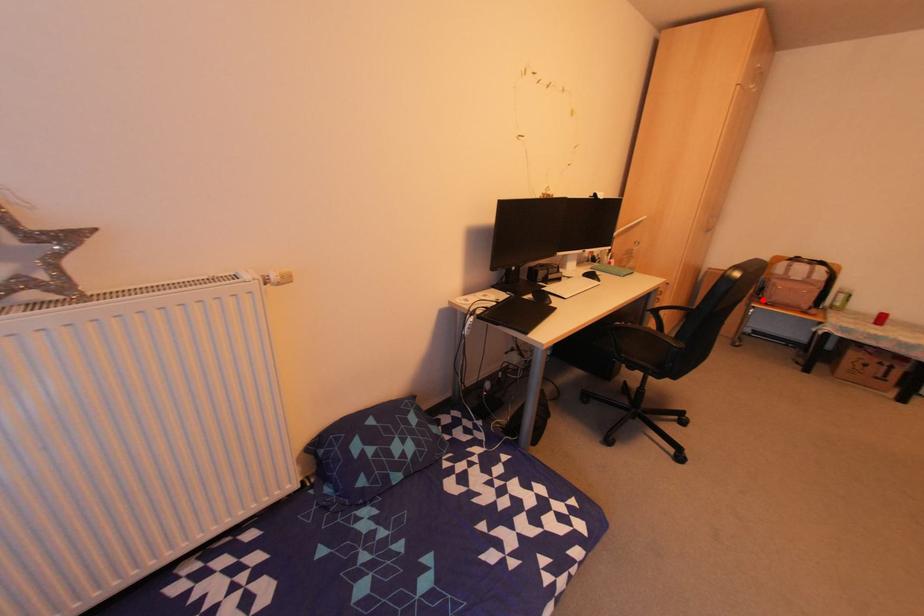
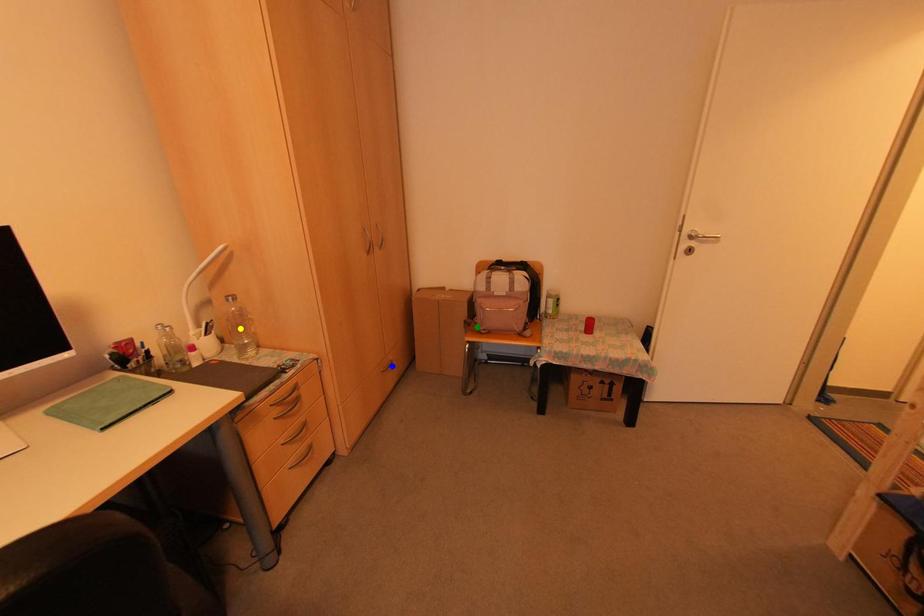
Question: I am providing you with two images of the same scene from different viewpoints. A red point is marked on the first image. You are given multiple points on the second image. Which mark in image 2 goes with the point in image 1?

Choices:
 (A) green point
 (B) blue point
 (C) yellow point

Answer: (A)